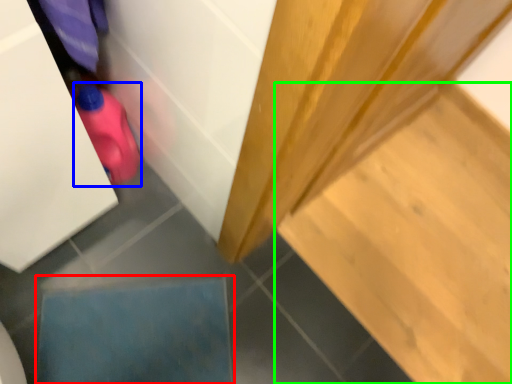
Question: Which object is the closest to the square (highlighted by a red box)? Choose among these: stuff (highlighted by a blue box) or stair (highlighted by a green box).

Choices:
 (A) stuff
 (B) stair

Answer: (A)